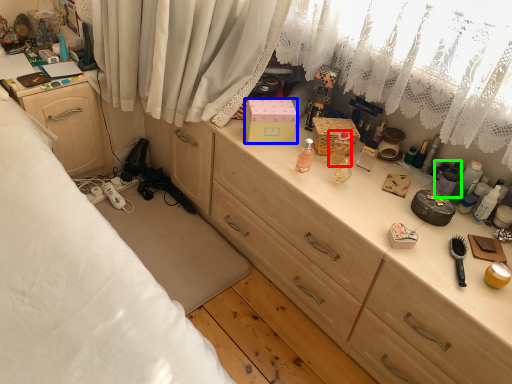
Question: Considering the real-world distances, which object is closest to toiletry (highlighted by a red box)? box (highlighted by a blue box) or toiletry (highlighted by a green box).

Choices:
 (A) box
 (B) toiletry

Answer: (A)